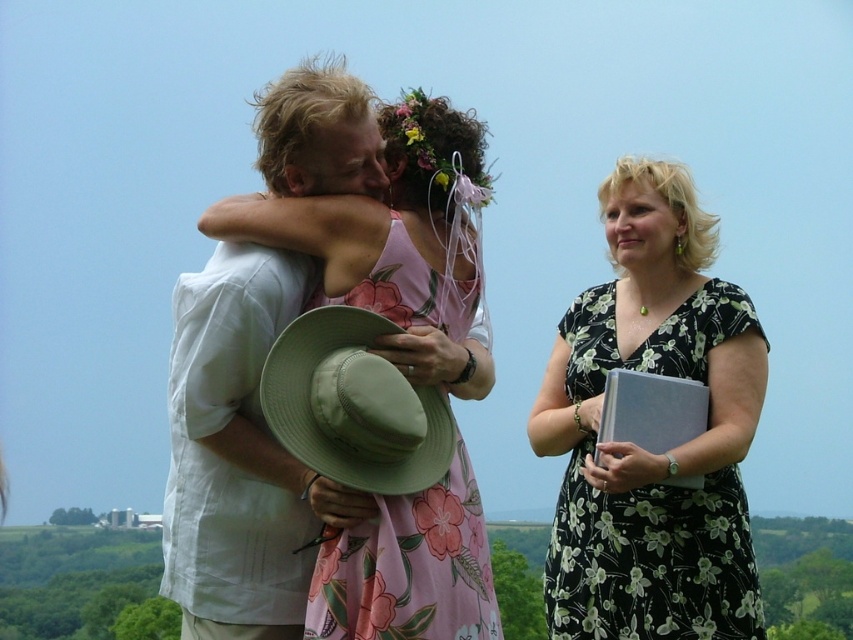
Question: Which point is farther to the camera?

Choices:
 (A) (727, 496)
 (B) (560, 365)
 (C) (289, 580)

Answer: (B)

Question: Does light beige cotton shirt at center appear on the left side of black floral dress at right?

Choices:
 (A) no
 (B) yes

Answer: (B)

Question: Is light beige cotton shirt at center to the left of pink floral fabric dress at center from the viewer's perspective?

Choices:
 (A) no
 (B) yes

Answer: (A)

Question: Which object is the closest to the black floral dress at right?

Choices:
 (A) pink floral fabric dress at center
 (B) white linen shirt at center
 (C) light beige cotton shirt at center

Answer: (C)

Question: In this image, where is light beige cotton shirt at center located relative to pink floral fabric dress at center?

Choices:
 (A) left
 (B) right

Answer: (B)

Question: Based on their relative distances, which object is farther from the black floral dress at right?

Choices:
 (A) light beige cotton shirt at center
 (B) white linen shirt at center
 (C) pink floral fabric dress at center

Answer: (C)